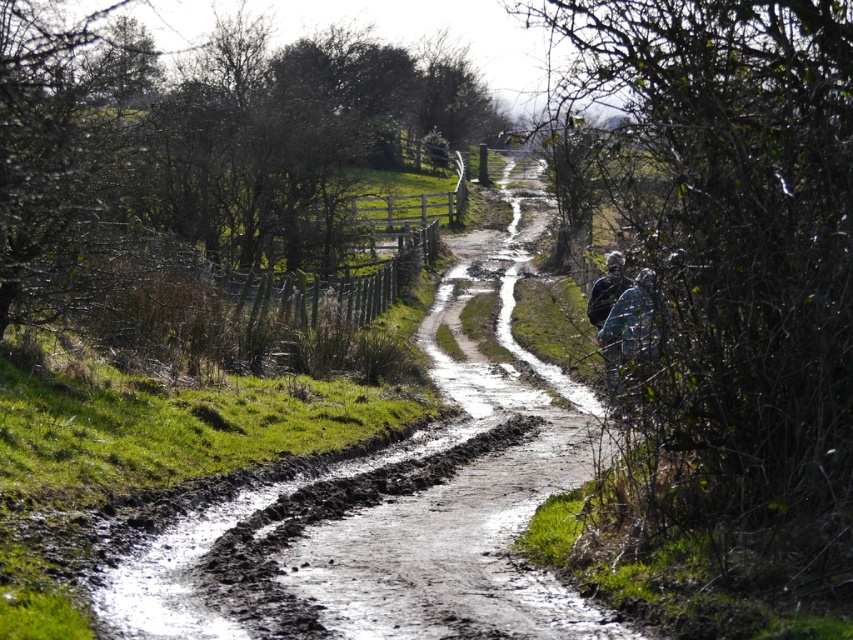
From the picture: You are a hiker carrying a camouflage fabric backpack at right and you see a blue fabric at right on the muddy path. Which fabric is closer to the wooden fence in the distance?

The blue fabric at right is positioned on the left side of camouflage fabric backpack at right. Since the path curves to the right and leads towards the wooden fence, the camouflage fabric backpack at right is closer to the wooden fence in the distance because it is positioned to the right of the blue fabric at right, aligning with the path direction.

You are a hiker carrying a camouflage fabric backpack at right and you see a blue fabric at right on the muddy path. Which item is nearer to you as you walk along the path?

The blue fabric at right is closer to the viewer than the camouflage fabric backpack at right, so the blue fabric at right is nearer to you as you walk along the path.